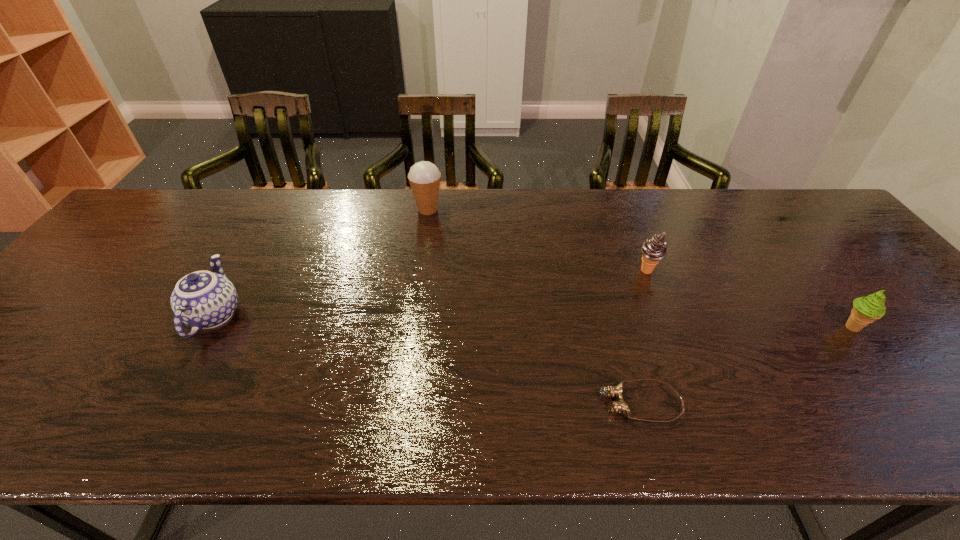
Locate an element on the screen. This screenshot has width=960, height=540. vacant space located on the front of the fourth nearest object is located at coordinates (661, 307).

Where is `vacant space located 0.260m at the spout of the leftmost object`? This screenshot has height=540, width=960. vacant space located 0.260m at the spout of the leftmost object is located at coordinates (267, 222).

The height and width of the screenshot is (540, 960). I want to click on vacant area located at the spout of the leftmost object, so click(x=282, y=197).

Identify the location of vacant area located 0.210m at the spout of the leftmost object. (261, 233).

Where is `free space located 0.080m on the back of the nearest icecream`? The image size is (960, 540). free space located 0.080m on the back of the nearest icecream is located at coordinates (826, 293).

Where is `free region located on the front lenses and sides of the shortest object`? The width and height of the screenshot is (960, 540). free region located on the front lenses and sides of the shortest object is located at coordinates (561, 403).

Locate an element on the screen. vacant space located on the front lenses and sides of the shortest object is located at coordinates (453, 403).

In order to click on vacant region located 0.220m on the front lenses and sides of the shortest object in this screenshot , I will do `click(492, 403)`.

Find the location of a particular element. The width and height of the screenshot is (960, 540). object that is at the far edge is located at coordinates (424, 177).

Where is `object situated at the near edge`? object situated at the near edge is located at coordinates (621, 407).